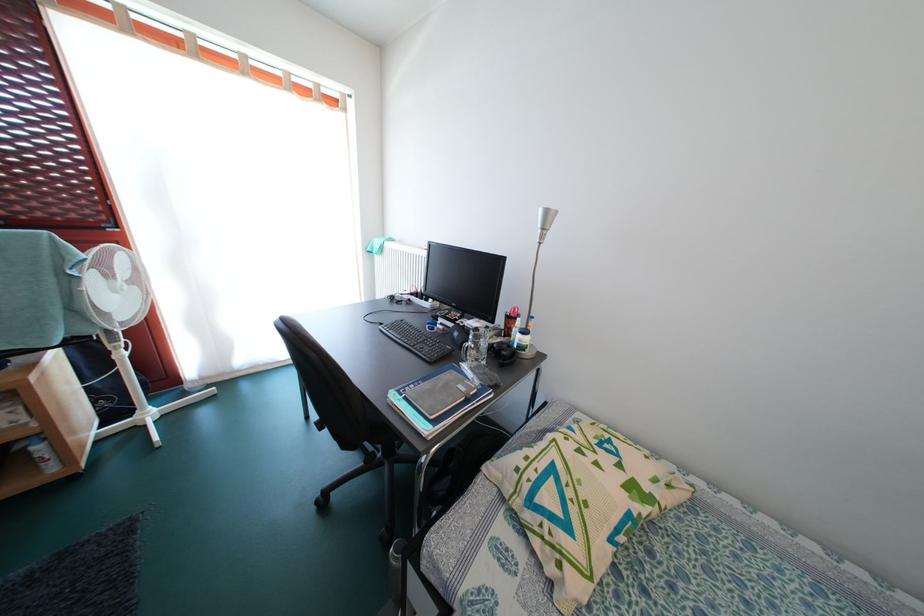
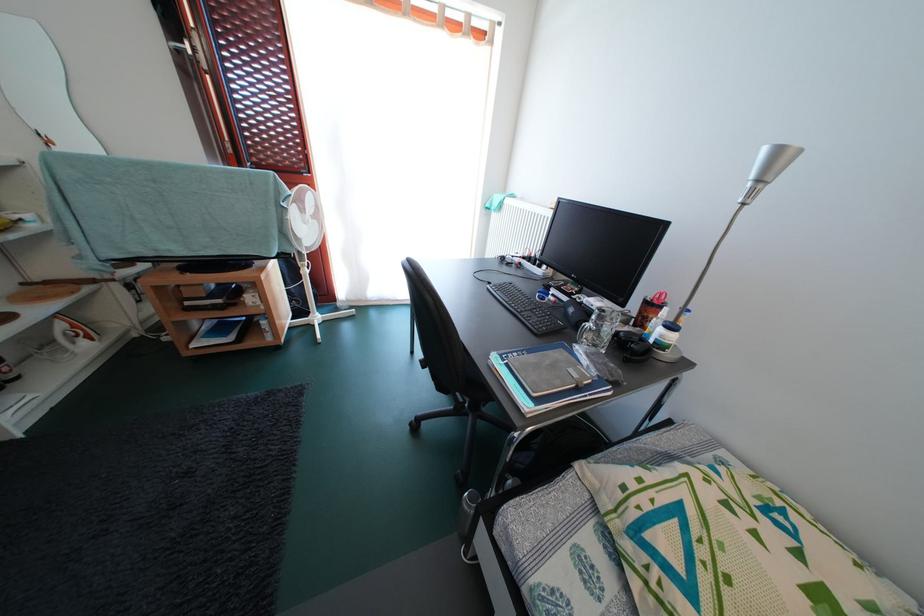
Locate, in the second image, the point that corresponds to pixel 515 338 in the first image.

(648, 328)